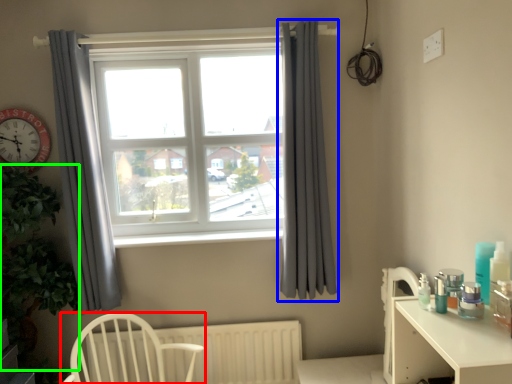
Question: Estimate the real-world distances between objects in this image. Which object is closer to chair (highlighted by a red box), curtain (highlighted by a blue box) or plant (highlighted by a green box)?

Choices:
 (A) curtain
 (B) plant

Answer: (B)